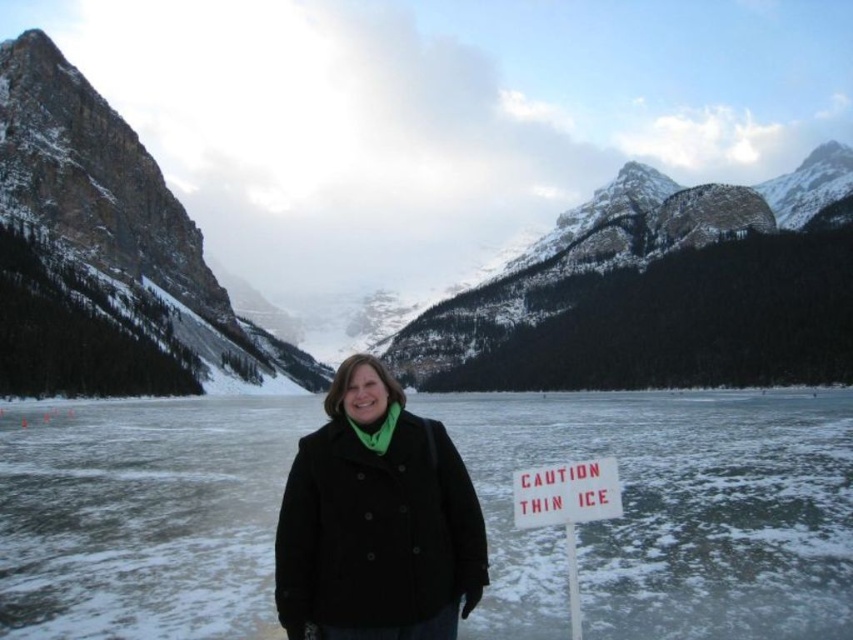
Question: Does white ice at center appear over black wool coat at center?

Choices:
 (A) no
 (B) yes

Answer: (A)

Question: Observing the image, what is the correct spatial positioning of white ice at center in reference to black wool coat at center?

Choices:
 (A) below
 (B) above

Answer: (A)

Question: Which point appears closest to the camera in this image?

Choices:
 (A) (320, 611)
 (B) (148, 529)
 (C) (115, 246)

Answer: (A)

Question: Can you confirm if white ice at center is positioned below snowy rock mountain at upper center?

Choices:
 (A) no
 (B) yes

Answer: (B)

Question: Which of the following is the closest to the observer?

Choices:
 (A) white ice at center
 (B) white plastic sign at lower right
 (C) snowy rock mountain at upper center
 (D) black wool coat at center

Answer: (D)

Question: Which object is positioned farthest from the white ice at center?

Choices:
 (A) white plastic sign at lower right
 (B) snowy rock mountain at upper center
 (C) black wool coat at center

Answer: (B)